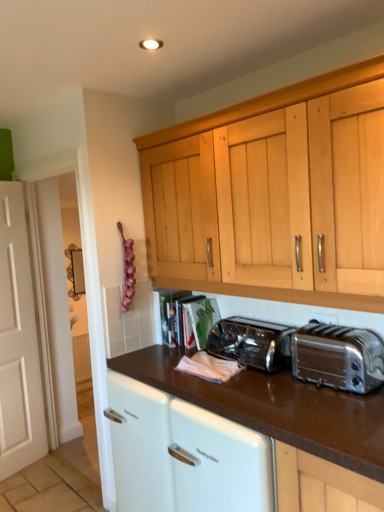
I want to click on free space underneath satin silver toaster at center, marked as the second toaster in a front-to-back arrangement (from a real-world perspective), so click(252, 358).